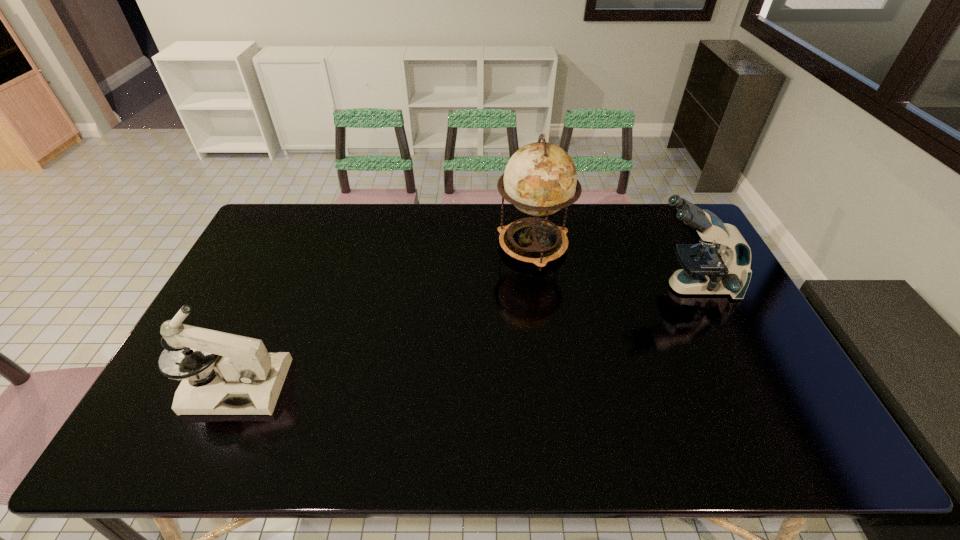
I want to click on object that is the closest to the leftmost object, so click(540, 178).

Locate which object is the second closest to the globe. Please provide its 2D coordinates. Your answer should be formatted as a tuple, i.e. [(x, y)], where the tuple contains the x and y coordinates of a point satisfying the conditions above.

[(248, 381)]

The image size is (960, 540). What are the coordinates of `vacant region that satisfies the following two spatial constraints: 1. at the center of the globe; 2. at the eyepiece of the leftmost object` in the screenshot? It's located at (552, 386).

Locate an element on the screen. The height and width of the screenshot is (540, 960). vacant space that satisfies the following two spatial constraints: 1. at the center of the second object from right to left; 2. at the eyepiece of the leftmost object is located at coordinates (552, 386).

Locate an element on the screen. vacant area in the image that satisfies the following two spatial constraints: 1. at the center of the second object from right to left; 2. at the eyepiece of the leftmost object is located at coordinates (552, 386).

You are a GUI agent. You are given a task and a screenshot of the screen. Output one action in this format:
    pyautogui.click(x=<x>, y=<y>)
    Task: Click on the vacant space that satisfies the following two spatial constraints: 1. at the center of the globe; 2. at the eyepiece of the nearest object
    The height and width of the screenshot is (540, 960).
    Given the screenshot: What is the action you would take?
    pyautogui.click(x=552, y=386)